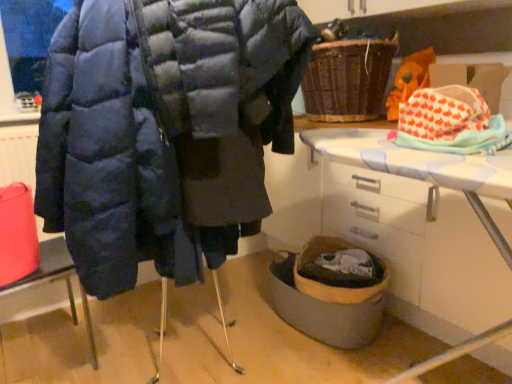
The width and height of the screenshot is (512, 384). What are the coordinates of `vacant region to the left of wooden woven basket at lower center` in the screenshot? It's located at point(214,332).